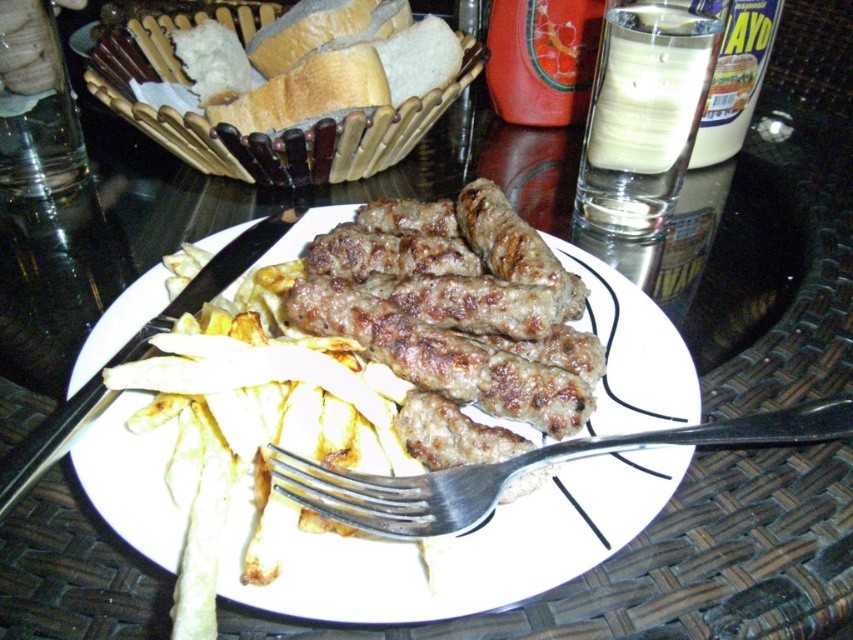
You are a food critic evaluating this dish. You notice a point at coordinates (248,422) on the plate. What item is located exactly at that point?

The item at point (248,422) is golden crispy fries at center.

You are a food delivery person who needs to place a hot pad between the white matte plate at center and the bread basket at upper left. The hot pad is 12 inches wide. Will it fit without overlapping either item?

The distance between the white matte plate at center and the bread basket at upper left is 11.26 inches. Since the hot pad is 12 inches wide, it will not fit without overlapping one or both items.

You are holding a ruler that is 12 inches long. You want to measure the distance from your current position to the point at coordinates point (158, 468). Can your ruler reach that point?

The distance between the camera and point (158, 468) is 16.24 inches, which is longer than the ruler you have. Therefore, your ruler cannot reach that point.